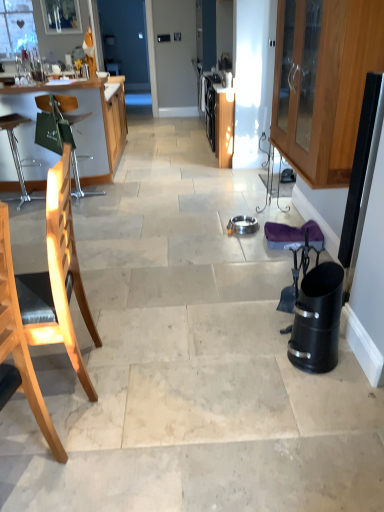
Locate an element on the screen. free space between light wood chair at left, which is the third chair from back to front, and black plastic trash can at right is located at coordinates point(178,419).